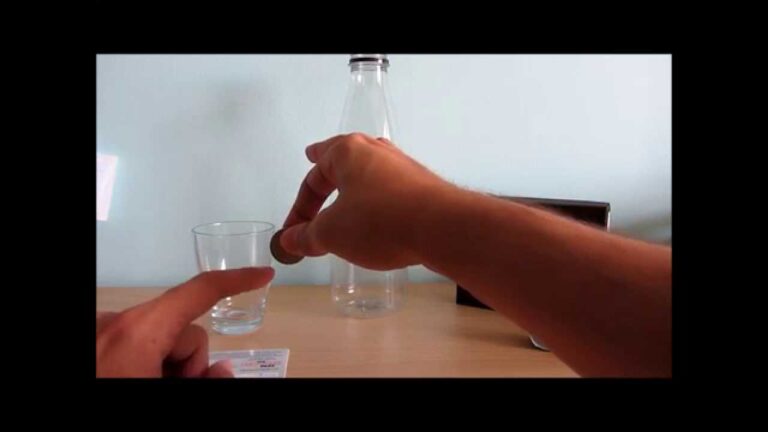
This screenshot has width=768, height=432. I want to click on empty glass bottle, so click(x=366, y=92).